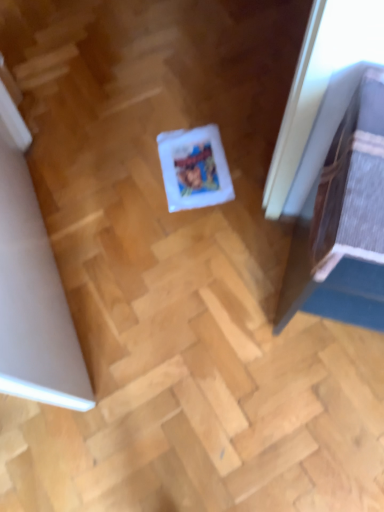
You are a GUI agent. You are given a task and a screenshot of the screen. Output one action in this format:
    pyautogui.click(x=<x>, y=<y>)
    Task: Click on the wooden door at right
    This screenshot has width=384, height=512.
    Given the screenshot: What is the action you would take?
    pyautogui.click(x=343, y=223)

Image resolution: width=384 pixels, height=512 pixels. Describe the element at coordinates (343, 223) in the screenshot. I see `wooden door at right` at that location.

Image resolution: width=384 pixels, height=512 pixels. Identify the location of wooden door at right. (343, 223).